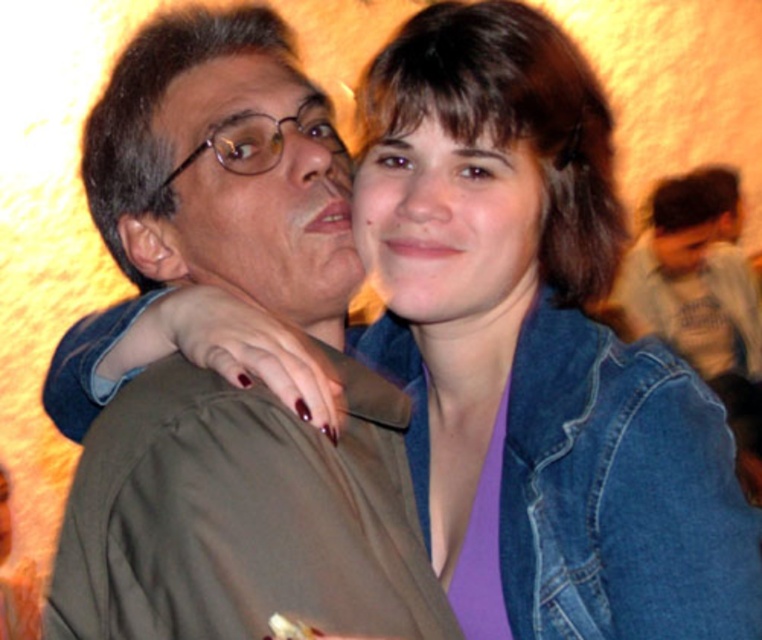
How much distance is there between light gray t-shirt at upper right and matte plastic glasses at upper left?

A distance of 3.41 meters exists between light gray t-shirt at upper right and matte plastic glasses at upper left.

Can you confirm if light gray t-shirt at upper right is smaller than matte plastic glasses at upper left?

Actually, light gray t-shirt at upper right might be larger than matte plastic glasses at upper left.

This screenshot has height=640, width=762. Describe the element at coordinates (690, 282) in the screenshot. I see `light gray t-shirt at upper right` at that location.

Locate an element on the screen. This screenshot has width=762, height=640. light gray t-shirt at upper right is located at coordinates (690, 282).

Is matte brown face at center below light gray t-shirt at upper right?

Yes, matte brown face at center is below light gray t-shirt at upper right.

Does matte brown face at center have a larger size compared to light gray t-shirt at upper right?

Incorrect, matte brown face at center is not larger than light gray t-shirt at upper right.

Who is more forward, (261, 90) or (735, 369)?

Point (261, 90)

The height and width of the screenshot is (640, 762). Find the location of `matte brown face at center`. matte brown face at center is located at coordinates (258, 188).

Does point (392, 301) lie in front of point (10, 547)?

Yes.

Find the location of a particular element. This screenshot has width=762, height=640. purple matte shirt at center is located at coordinates (447, 225).

Find the location of a particular element. Image resolution: width=762 pixels, height=640 pixels. purple matte shirt at center is located at coordinates (447, 225).